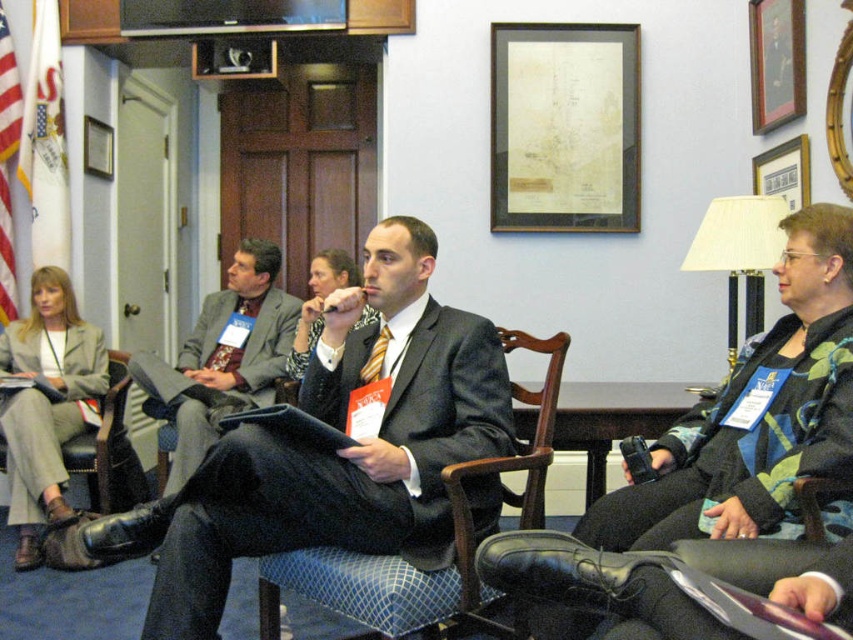
Based on the photo, you are an interior designer planning to place a 1.2 meter wide sofa in this room. Given the space occupied by the black woolen jacket at lower right and the leather armchair at lower left, which object would you consider moving to accommodate the sofa?

The black woolen jacket at lower right is wider than the leather armchair at lower left. To accommodate the 1.2 meter wide sofa, you should consider moving the black woolen jacket at lower right since it occupies more space.